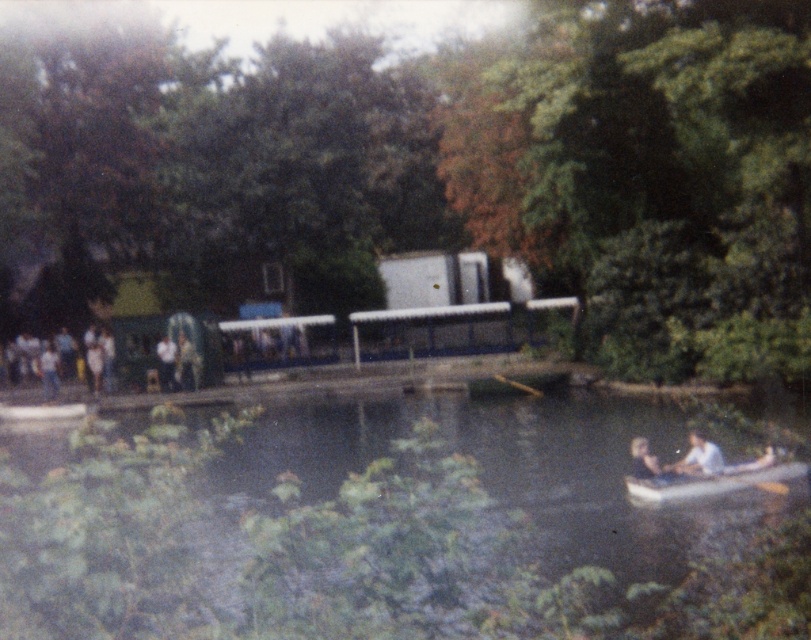
Question: Considering the real-world distances, which object is farthest from the light brown leather jacket at center?

Choices:
 (A) wooden paddle at center
 (B) wooden paddle at lower right
 (C) white cotton shirt at lower right

Answer: (B)

Question: Which of these objects is positioned farthest from the light brown wooden paddle boat at lower right?

Choices:
 (A) wooden paddle at lower right
 (B) light brown leather jacket at center
 (C) smooth skin face at lower right

Answer: (B)

Question: Does green leafy river at lower center appear on the left side of wooden paddle at center?

Choices:
 (A) yes
 (B) no

Answer: (A)

Question: Among these points, which one is farthest from the camera?

Choices:
 (A) (685, 472)
 (B) (166, 344)
 (C) (758, 467)

Answer: (B)

Question: Can you confirm if wooden paddle at lower right is wider than light brown wooden paddle boat at lower right?

Choices:
 (A) yes
 (B) no

Answer: (A)

Question: Does white cotton shirt at lower right appear under light brown wooden paddle boat at lower right?

Choices:
 (A) no
 (B) yes

Answer: (A)